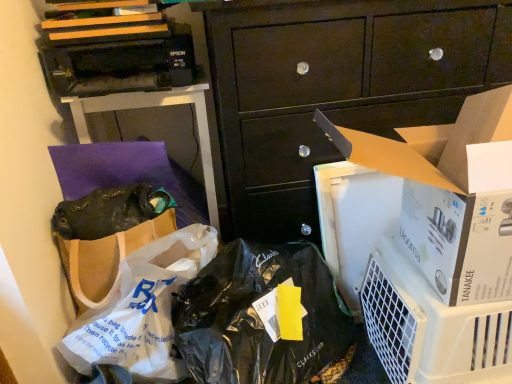
Locate an element on the screen. dark wood cabinet at center is located at coordinates (336, 87).

What are the coordinates of `matte black handbag at center-left` in the screenshot? It's located at (106, 235).

Looking at this image, does brown paper bag at upper left have a smaller size compared to white plastic bag at lower left?

Actually, brown paper bag at upper left might be larger than white plastic bag at lower left.

From a real-world perspective, is brown paper bag at upper left physically above white plastic bag at lower left?

Yes, from a real-world perspective, brown paper bag at upper left is above white plastic bag at lower left.

Is brown paper bag at upper left inside or outside of white plastic bag at lower left?

brown paper bag at upper left is outside white plastic bag at lower left.

In the image, is brown paper bag at upper left positioned in front of or behind white plastic air purifier at lower right?

In the image, brown paper bag at upper left appears behind white plastic air purifier at lower right.

Is brown paper bag at upper left inside or outside of white plastic air purifier at lower right?

brown paper bag at upper left is outside white plastic air purifier at lower right.

Is brown paper bag at upper left wider or thinner than white plastic air purifier at lower right?

Clearly, brown paper bag at upper left has less width compared to white plastic air purifier at lower right.

Can you tell me how much brown paper bag at upper left and white plastic air purifier at lower right differ in facing direction?

They differ by 10.6 degrees in their facing directions.

From the image's perspective, is white cardboard box at center-right positioned above or below dark wood cabinet at center?

Clearly, from the image's perspective, white cardboard box at center-right is below dark wood cabinet at center.

Between white cardboard box at center-right and dark wood cabinet at center, which one has larger size?

Bigger between the two is dark wood cabinet at center.

Can you tell me how much white cardboard box at center-right and dark wood cabinet at center differ in facing direction?

The angular difference between white cardboard box at center-right and dark wood cabinet at center is 1.29 degrees.

How many degrees apart are the facing directions of brown paper bag at upper left and matte black handbag at center-left?

25.1 degrees.

From the picture: Considering the sizes of objects brown paper bag at upper left and matte black handbag at center-left in the image provided, who is shorter, brown paper bag at upper left or matte black handbag at center-left?

matte black handbag at center-left is shorter.

Is the depth of brown paper bag at upper left greater than that of matte black handbag at center-left?

Yes, it is.

From the image's perspective, is brown paper bag at upper left on matte black handbag at center-left?

Correct, brown paper bag at upper left appears higher than matte black handbag at center-left in the image.

How much distance is there between white plastic bag at lower left and white plastic air purifier at lower right?

white plastic bag at lower left is 20.98 inches from white plastic air purifier at lower right.

Is white plastic bag at lower left in front of or behind white plastic air purifier at lower right in the image?

white plastic bag at lower left is positioned closer to the viewer than white plastic air purifier at lower right.

Which is more to the right, white plastic bag at lower left or white plastic air purifier at lower right?

white plastic air purifier at lower right is more to the right.

Locate an element on the screen. The height and width of the screenshot is (384, 512). appliance beneath the white plastic bag at lower left (from a real-world perspective) is located at coordinates (431, 327).

From the image's perspective, does white plastic bag at lower left appear higher than matte black handbag at center-left?

No.

Is white plastic bag at lower left not near matte black handbag at center-left?

They are positioned close to each other.

Is white plastic bag at lower left to the left of matte black handbag at center-left from the viewer's perspective?

No.

From a real-world perspective, who is located higher, white plastic bag at lower left or matte black handbag at center-left?

In real-world perspective, matte black handbag at center-left is above.

Is dark wood cabinet at center oriented towards white plastic air purifier at lower right?

Yes, dark wood cabinet at center faces towards white plastic air purifier at lower right.

From a real-world perspective, is dark wood cabinet at center above or below white plastic air purifier at lower right?

dark wood cabinet at center is situated higher than white plastic air purifier at lower right in the real world.

From the image's perspective, is dark wood cabinet at center positioned above or below white plastic air purifier at lower right?

From the image's perspective, dark wood cabinet at center appears above white plastic air purifier at lower right.

Is white plastic air purifier at lower right surrounded by dark wood cabinet at center?

That's incorrect, white plastic air purifier at lower right is not inside dark wood cabinet at center.

This screenshot has width=512, height=384. In order to click on desk that appears behind the white plastic bag at lower left in this screenshot , I will do `click(155, 106)`.

Identify the location of desk above the white plastic air purifier at lower right (from the image's perspective). (155, 106).

Looking at the image, which one is located closer to white plastic bag at lower left, matte black handbag at center-left or dark wood cabinet at center?

matte black handbag at center-left lies closer to white plastic bag at lower left than the other object.

Considering their positions, is dark wood cabinet at center positioned closer to white plastic air purifier at lower right than brown paper bag at upper left?

Based on the image, dark wood cabinet at center appears to be nearer to white plastic air purifier at lower right.

Estimate the real-world distances between objects in this image. Which object is closer to white plastic air purifier at lower right, dark wood cabinet at center or matte black handbag at center-left?

Based on the image, dark wood cabinet at center appears to be nearer to white plastic air purifier at lower right.

Looking at this image, considering their positions, is white cardboard box at center-right positioned further to brown paper bag at upper left than dark wood cabinet at center?

white cardboard box at center-right is positioned further to the anchor brown paper bag at upper left.

When comparing their distances from white cardboard box at center-right, does white plastic air purifier at lower right or brown paper bag at upper left seem closer?

white plastic air purifier at lower right.

Considering their positions, is white plastic bag at lower left positioned closer to white cardboard box at center-right than matte black handbag at center-left?

Based on the image, white plastic bag at lower left appears to be nearer to white cardboard box at center-right.

Based on their spatial positions, is white cardboard box at center-right or brown paper bag at upper left closer to dark wood cabinet at center?

Among the two, white cardboard box at center-right is located nearer to dark wood cabinet at center.

Considering their positions, is brown paper bag at upper left positioned closer to white plastic air purifier at lower right than dark wood cabinet at center?

The object closer to white plastic air purifier at lower right is dark wood cabinet at center.

At what (x,y) coordinates should I click in order to perform the action: click on cabinetry located between matte black handbag at center-left and white plastic air purifier at lower right in the left-right direction. Please return your answer as a coordinate pair (x, y). Image resolution: width=512 pixels, height=384 pixels. Looking at the image, I should click on (336, 87).

In order to click on plastic bag located between matte black handbag at center-left and white cardboard box at center-right in the left-right direction in this screenshot , I will do `click(141, 308)`.

Identify the location of cardboard box between brown paper bag at upper left and dark wood cabinet at center from left to right. Image resolution: width=512 pixels, height=384 pixels. (450, 194).

Where is `cabinetry situated between white plastic bag at lower left and white plastic air purifier at lower right from left to right`? cabinetry situated between white plastic bag at lower left and white plastic air purifier at lower right from left to right is located at coordinates (x=336, y=87).